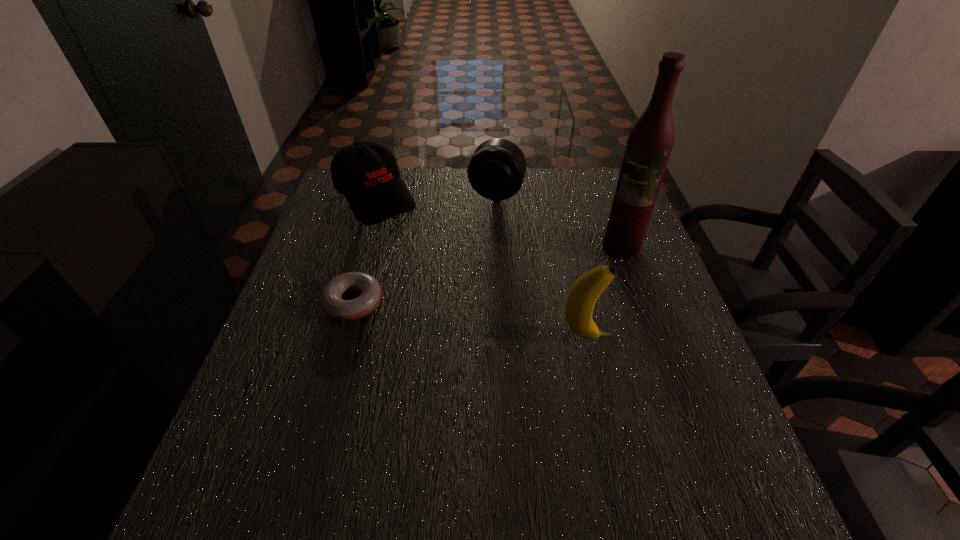
Where is `vacant space that's between the fourth object from left to right and the third object from left to right`? This screenshot has height=540, width=960. vacant space that's between the fourth object from left to right and the third object from left to right is located at coordinates (541, 265).

Where is `unoccupied position between the telephoto lens and the banana`? The image size is (960, 540). unoccupied position between the telephoto lens and the banana is located at coordinates (541, 265).

Where is `vacant point located between the fourth object from left to right and the second nearest object`? This screenshot has height=540, width=960. vacant point located between the fourth object from left to right and the second nearest object is located at coordinates (470, 320).

Identify the location of empty location between the telephoto lens and the second nearest object. Image resolution: width=960 pixels, height=540 pixels. (425, 247).

At what (x,y) coordinates should I click in order to perform the action: click on free space between the tallest object and the telephoto lens. Please return your answer as a coordinate pair (x, y). The width and height of the screenshot is (960, 540). Looking at the image, I should click on (559, 219).

Identify the location of free spot between the telephoto lens and the rightmost object. This screenshot has width=960, height=540. (559, 219).

Find the location of a particular element. The width and height of the screenshot is (960, 540). free space between the third object from right to left and the rightmost object is located at coordinates (559, 219).

I want to click on vacant space in between the doughnut and the telephoto lens, so click(425, 247).

Where is `vacant area between the baseball cap and the liquor`? vacant area between the baseball cap and the liquor is located at coordinates (498, 222).

Identify the location of unoccupied position between the shortest object and the baseball cap. The height and width of the screenshot is (540, 960). (365, 250).